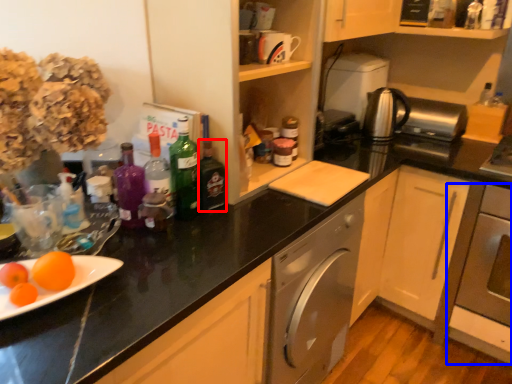
Question: Which object is closer to the camera taking this photo, bottle (highlighted by a red box) or oven (highlighted by a blue box)?

Choices:
 (A) bottle
 (B) oven

Answer: (A)